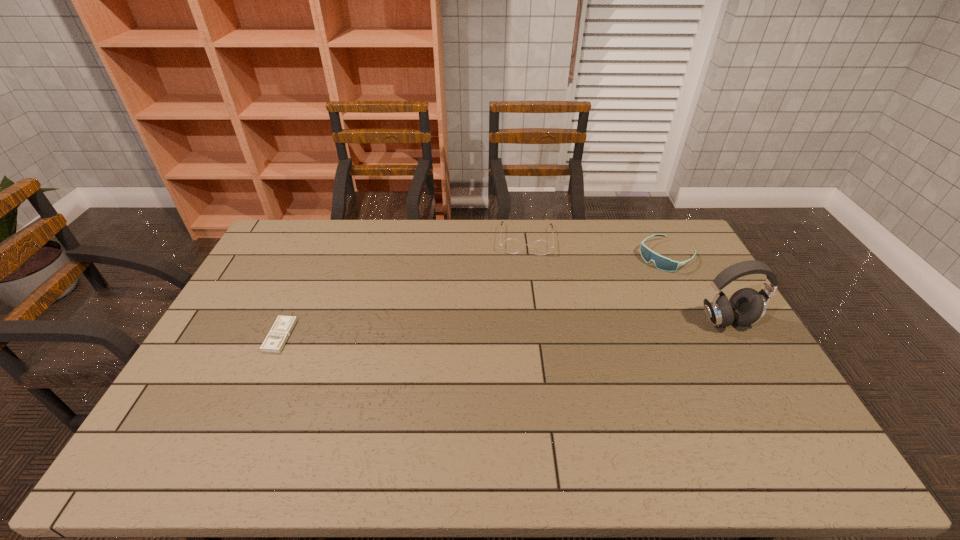
Locate an element on the screen. The width and height of the screenshot is (960, 540). the shortest object is located at coordinates (274, 342).

Find the location of a particular element. money is located at coordinates (274, 342).

At what (x,y) coordinates should I click in order to perform the action: click on headset. Please return your answer as a coordinate pair (x, y). The image size is (960, 540). Looking at the image, I should click on click(x=746, y=306).

Locate an element on the screen. Image resolution: width=960 pixels, height=540 pixels. goggles is located at coordinates (662, 263).

Find the location of a particular element. the third object from right to left is located at coordinates (541, 247).

I want to click on free point located 0.200m on the right of the money, so click(358, 336).

At what (x,y) coordinates should I click in order to perform the action: click on free region located 0.170m on the ear cups of the headset. Please return your answer as a coordinate pair (x, y). The image size is (960, 540). Looking at the image, I should click on (761, 382).

You are a GUI agent. You are given a task and a screenshot of the screen. Output one action in this format:
    pyautogui.click(x=<x>, y=<y>)
    Task: Click on the vacant position located 0.250m on the front-facing side of the goggles
    
    Given the screenshot: What is the action you would take?
    point(607,299)

You are a GUI agent. You are given a task and a screenshot of the screen. Output one action in this format:
    pyautogui.click(x=<x>, y=<y>)
    Task: Click on the free spot located 0.140m on the front-facing side of the goggles
    This screenshot has width=960, height=540.
    Given the screenshot: What is the action you would take?
    pyautogui.click(x=627, y=284)

Locate an element on the screen. The width and height of the screenshot is (960, 540). vacant area situated 0.060m on the front-facing side of the goggles is located at coordinates (640, 274).